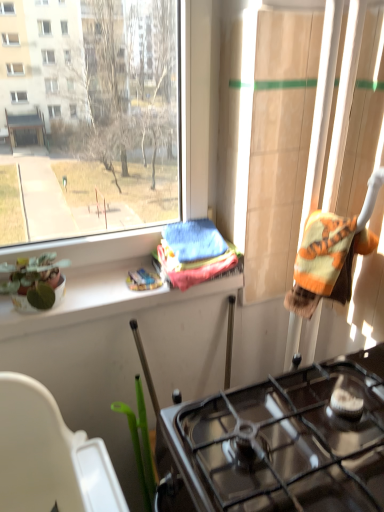
Find the location of a particular element. This screenshot has height=512, width=384. vacant area on top of green matte plant pot at left (from a real-world perspective) is located at coordinates (112, 280).